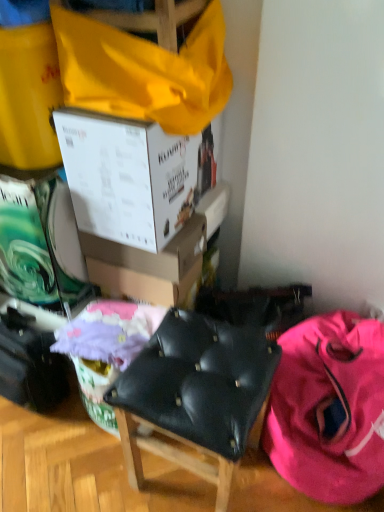
Question: Considering the relative sizes of white cardboard box at upper center, arranged as the second box when viewed from the top, and pink fabric backpack at lower right in the image provided, is white cardboard box at upper center, arranged as the second box when viewed from the top, shorter than pink fabric backpack at lower right?

Choices:
 (A) yes
 (B) no

Answer: (A)

Question: From the image's perspective, is white cardboard box at upper center, the 1th box positioned from the bottom, below pink fabric backpack at lower right?

Choices:
 (A) no
 (B) yes

Answer: (A)

Question: Is white cardboard box at upper center, the 1th box positioned from the bottom, to the right of pink fabric backpack at lower right from the viewer's perspective?

Choices:
 (A) no
 (B) yes

Answer: (A)

Question: Is white cardboard box at upper center, arranged as the second box when viewed from the top, aimed at pink fabric backpack at lower right?

Choices:
 (A) yes
 (B) no

Answer: (B)

Question: Is pink fabric backpack at lower right located within white cardboard box at upper center, the 1th box positioned from the bottom?

Choices:
 (A) yes
 (B) no

Answer: (B)

Question: Is the position of white cardboard box at upper center, the 1th box positioned from the bottom, more distant than that of pink fabric backpack at lower right?

Choices:
 (A) yes
 (B) no

Answer: (A)

Question: Is white cardboard box at upper center, which ranks as the second box in bottom-to-top order, at the back of white cardboard box at upper center, the 1th box positioned from the bottom?

Choices:
 (A) yes
 (B) no

Answer: (B)

Question: Considering the relative sizes of white cardboard box at upper center, the 1th box positioned from the bottom, and white cardboard box at upper center, which ranks as the second box in bottom-to-top order, in the image provided, is white cardboard box at upper center, the 1th box positioned from the bottom, bigger than white cardboard box at upper center, which ranks as the second box in bottom-to-top order,?

Choices:
 (A) yes
 (B) no

Answer: (B)

Question: Is white cardboard box at upper center, the 1th box positioned from the bottom, wider than white cardboard box at upper center, which ranks as the second box in bottom-to-top order?

Choices:
 (A) no
 (B) yes

Answer: (A)

Question: Is white cardboard box at upper center, the 1th box positioned from the bottom, thinner than white cardboard box at upper center, positioned as the 1th box in top-to-bottom order?

Choices:
 (A) yes
 (B) no

Answer: (A)

Question: Considering the relative sizes of white cardboard box at upper center, arranged as the second box when viewed from the top, and white cardboard box at upper center, which ranks as the second box in bottom-to-top order, in the image provided, is white cardboard box at upper center, arranged as the second box when viewed from the top, shorter than white cardboard box at upper center, which ranks as the second box in bottom-to-top order,?

Choices:
 (A) yes
 (B) no

Answer: (A)

Question: Is the surface of white cardboard box at upper center, the 1th box positioned from the bottom, in direct contact with white cardboard box at upper center, which ranks as the second box in bottom-to-top order?

Choices:
 (A) yes
 (B) no

Answer: (B)

Question: Is pastel pink fabric at center taller than pink fabric backpack at lower right?

Choices:
 (A) yes
 (B) no

Answer: (B)